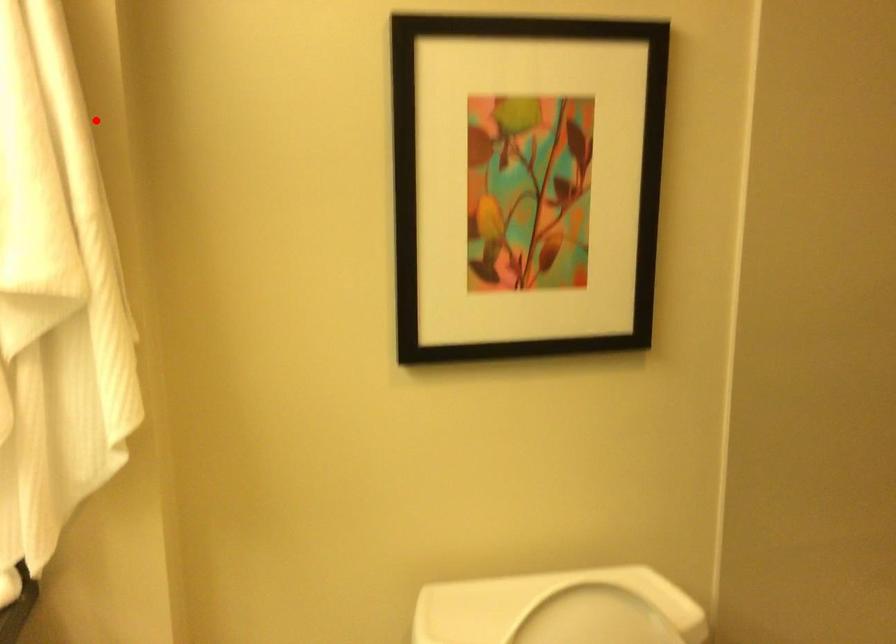
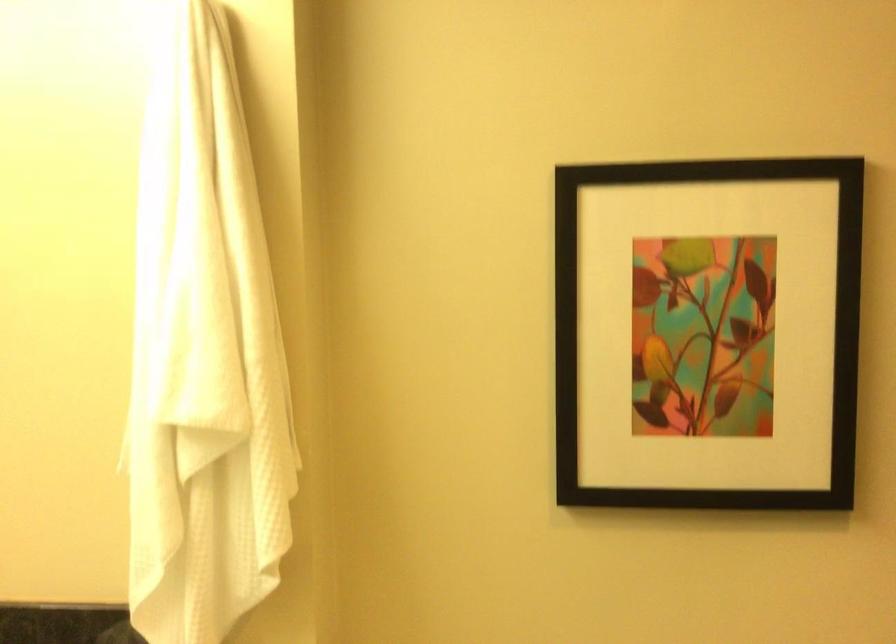
Find the pixel in the second image that matches the highlighted location in the first image.

(279, 267)